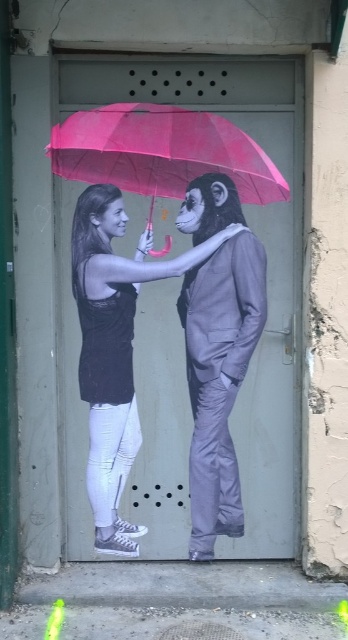
Who is higher up, metallic gray suit at center or matte black suit at center?

metallic gray suit at center is higher up.

You are a GUI agent. You are given a task and a screenshot of the screen. Output one action in this format:
    pyautogui.click(x=<x>, y=<y>)
    Task: Click on the metallic gray suit at center
    The width and height of the screenshot is (348, 640).
    Given the screenshot: What is the action you would take?
    pyautogui.click(x=218, y=378)

In order to click on metallic gray suit at center in this screenshot , I will do `click(218, 378)`.

In the scene shown: Can you confirm if metallic gray suit at center is shorter than pink matte umbrella at upper center?

In fact, metallic gray suit at center may be taller than pink matte umbrella at upper center.

Does metallic gray suit at center have a smaller size compared to pink matte umbrella at upper center?

Correct, metallic gray suit at center occupies less space than pink matte umbrella at upper center.

Locate an element on the screen. The image size is (348, 640). metallic gray suit at center is located at coordinates (218, 378).

Is point (76, 225) farther from camera compared to point (162, 179)?

Yes, it is behind point (162, 179).

Does matte black suit at center have a greater height compared to pink matte umbrella at upper center?

Yes, matte black suit at center is taller than pink matte umbrella at upper center.

Which is in front, point (98, 461) or point (241, 192)?

Point (241, 192)

Locate an element on the screen. The width and height of the screenshot is (348, 640). matte black suit at center is located at coordinates (114, 348).